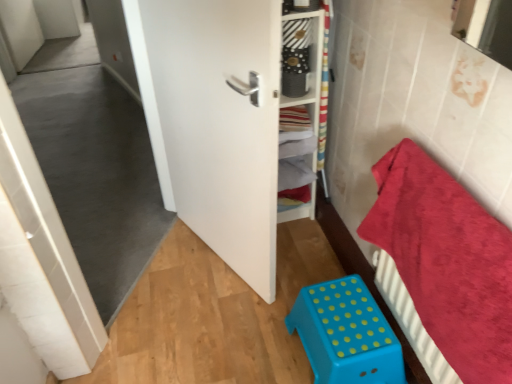
Question: Is red plush towel at right wider or thinner than white matte door at center?

Choices:
 (A) wide
 (B) thin

Answer: (B)

Question: Considering the relative positions of red plush towel at right and white matte door at center in the image provided, is red plush towel at right to the left or to the right of white matte door at center?

Choices:
 (A) right
 (B) left

Answer: (A)

Question: Which object is positioned closest to the white matte door at center?

Choices:
 (A) white wooden shelf at center
 (B) blue plastic stool at lower center
 (C) red plush towel at right

Answer: (A)

Question: Estimate the real-world distances between objects in this image. Which object is farther from the blue plastic stool at lower center?

Choices:
 (A) white wooden shelf at center
 (B) red plush towel at right
 (C) white matte door at center

Answer: (A)